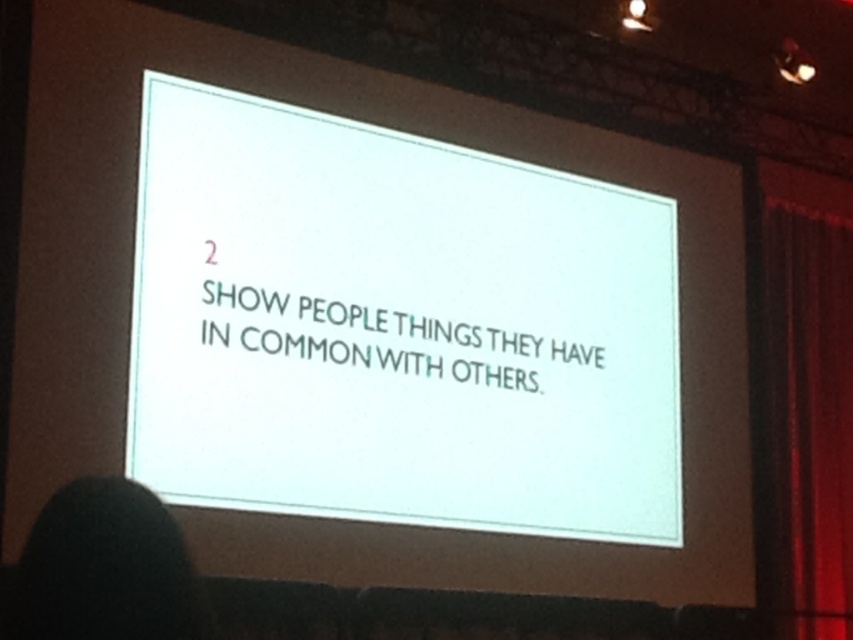
Question: Which of the following is the closest to the observer?

Choices:
 (A) red velvet curtain at right
 (B) black hair at lower left
 (C) white paper at center

Answer: (B)

Question: Is red velvet curtain at right further to camera compared to black hair at lower left?

Choices:
 (A) yes
 (B) no

Answer: (A)

Question: Which point is closer to the camera?

Choices:
 (A) black hair at lower left
 (B) white paper at center
 (C) red velvet curtain at right

Answer: (A)

Question: Which object is farther from the camera taking this photo?

Choices:
 (A) red velvet curtain at right
 (B) black hair at lower left

Answer: (A)

Question: Does white paper at center lie in front of red velvet curtain at right?

Choices:
 (A) no
 (B) yes

Answer: (B)

Question: Does white paper at center have a smaller size compared to red velvet curtain at right?

Choices:
 (A) yes
 (B) no

Answer: (B)